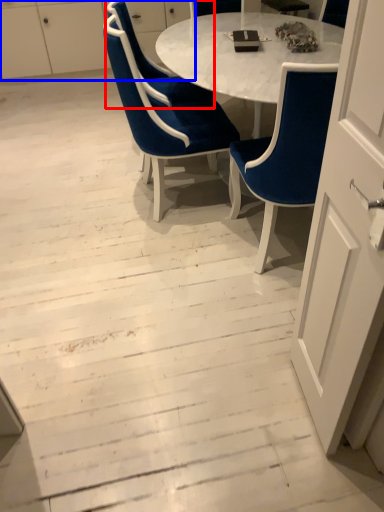
Question: Which of the following is the closest to the observer, chair (highlighted by a red box) or dresser (highlighted by a blue box)?

Choices:
 (A) chair
 (B) dresser

Answer: (A)